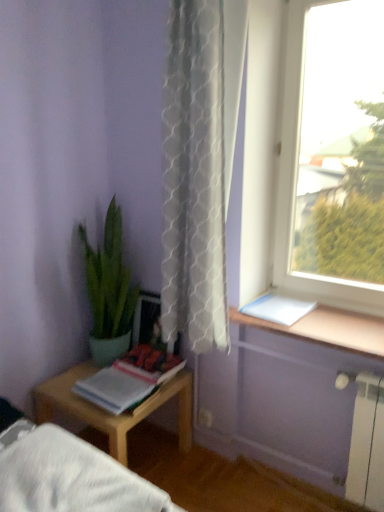
This screenshot has width=384, height=512. Find the location of `free space below matte paper book at lower left, which ranks as the 1th book in bottom-to-top order (from a real-world perspective)`. free space below matte paper book at lower left, which ranks as the 1th book in bottom-to-top order (from a real-world perspective) is located at coordinates (126, 398).